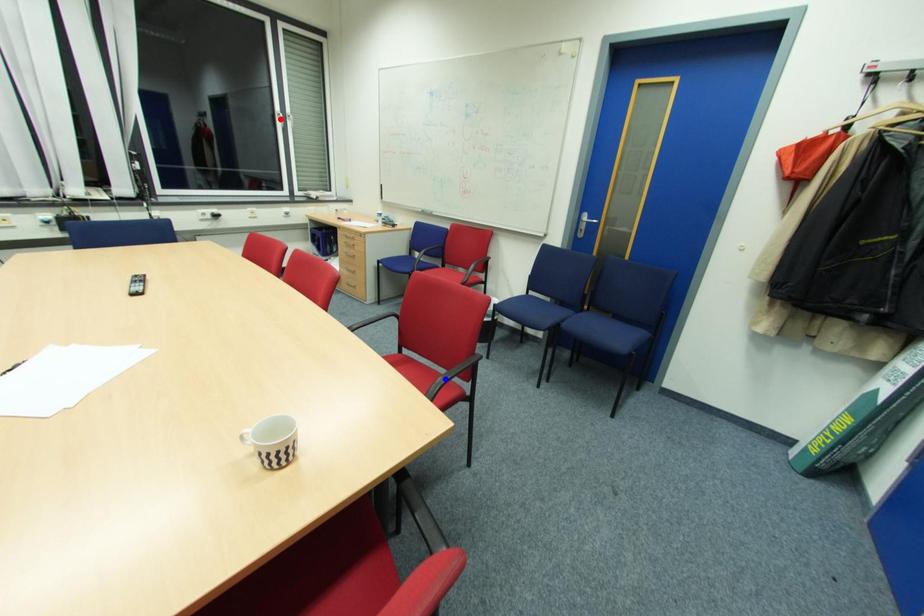
Question: In the image, two points are highlighted. Which point is nearer to the camera? Reply with the corresponding letter.

Choices:
 (A) blue point
 (B) red point

Answer: (A)